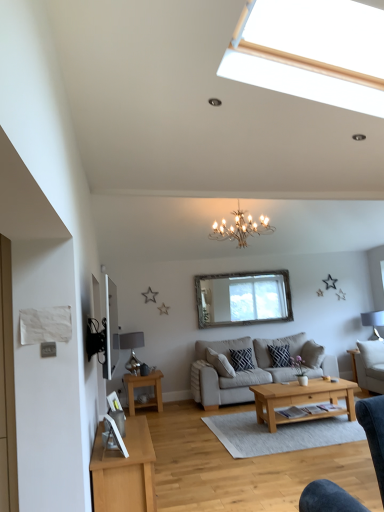
Question: From the image's perspective, is light brown wooden coffee table at center located above white glossy picture frame at lower left?

Choices:
 (A) no
 (B) yes

Answer: (A)

Question: Would you say light brown wooden coffee table at center is a long distance from white glossy picture frame at lower left?

Choices:
 (A) no
 (B) yes

Answer: (B)

Question: From a real-world perspective, is light brown wooden coffee table at center on top of white glossy picture frame at lower left?

Choices:
 (A) no
 (B) yes

Answer: (A)

Question: Is light brown wooden coffee table at center bigger than white glossy picture frame at lower left?

Choices:
 (A) yes
 (B) no

Answer: (A)

Question: Does light brown wooden coffee table at center lie in front of white glossy picture frame at lower left?

Choices:
 (A) yes
 (B) no

Answer: (B)

Question: Is light brown wooden coffee table at center aimed at white glossy picture frame at lower left?

Choices:
 (A) yes
 (B) no

Answer: (B)

Question: Considering the relative sizes of light wood/texture side table at lower left and light brown wooden coffee table at center in the image provided, is light wood/texture side table at lower left thinner than light brown wooden coffee table at center?

Choices:
 (A) no
 (B) yes

Answer: (B)

Question: Is light wood/texture side table at lower left turned away from light brown wooden coffee table at center?

Choices:
 (A) yes
 (B) no

Answer: (B)

Question: From the image's perspective, is light wood/texture side table at lower left above light brown wooden coffee table at center?

Choices:
 (A) no
 (B) yes

Answer: (A)

Question: Does light wood/texture side table at lower left come behind light brown wooden coffee table at center?

Choices:
 (A) yes
 (B) no

Answer: (A)

Question: Are light wood/texture side table at lower left and light brown wooden coffee table at center beside each other?

Choices:
 (A) yes
 (B) no

Answer: (B)

Question: Can you confirm if light wood/texture side table at lower left is positioned to the left of light brown wooden coffee table at center?

Choices:
 (A) no
 (B) yes

Answer: (B)

Question: Is beige fabric couch at center turned away from white fabric lampshade at right, marked as the first lamp in a back-to-front arrangement?

Choices:
 (A) yes
 (B) no

Answer: (B)